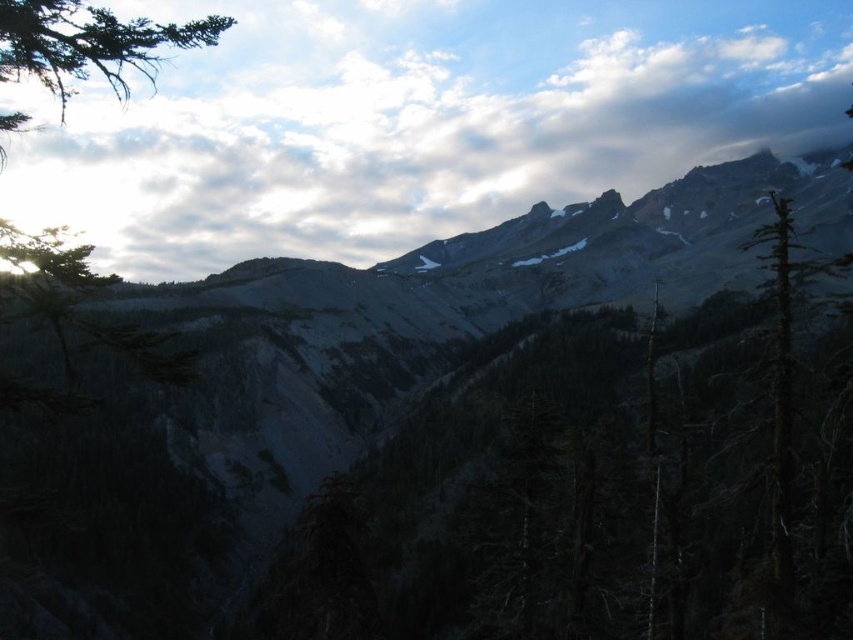
You are an observer standing in the mountain landscape. You notice the white fluffy cloud at upper center and the dark green textured tree at right. Which object is located more to the right side of the image?

The dark green textured tree at right is more to the right side of the image.

You are a hiker planning to traverse between two points marked in the image. The coordinates for these points are point (265, 205). Based on the mountainous terrain and elevation changes, estimate the time it would take to walk between them at a moderate pace of 3 km per hour. Consider the elevation gain and the rugged terrain described in the scene.

The two points are 608.30 meters apart. At a moderate pace of 3 km per hour, it would take approximately 12.17 minutes to walk this distance on flat terrain. However, the mountainous terrain with rugged peaks and slopes, as described in the scene, would significantly slow progress due to elevation changes and uneven ground. A more realistic estimate would be around 20 to 25 minutes, accounting for the need to navigate rocky surfaces and possible steep ascents or descents.